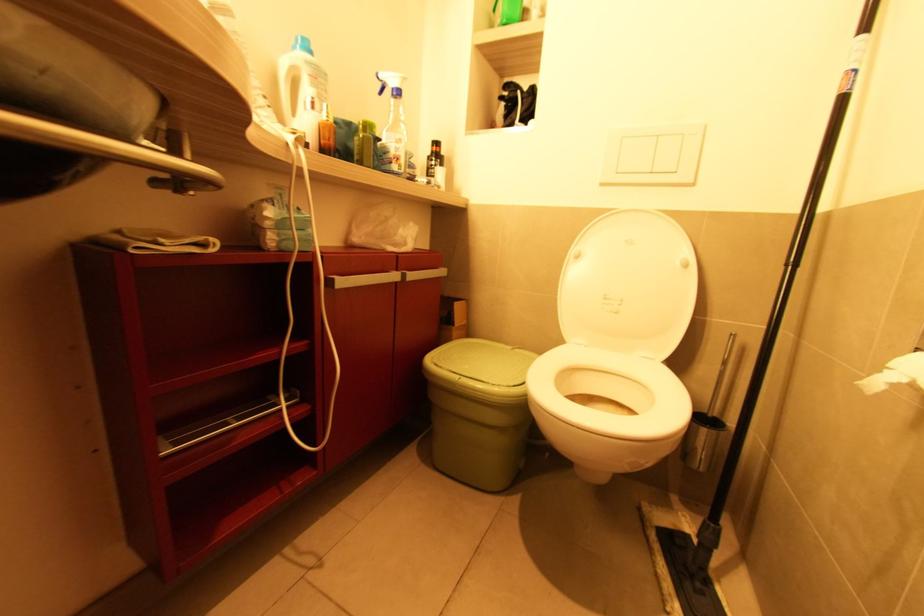
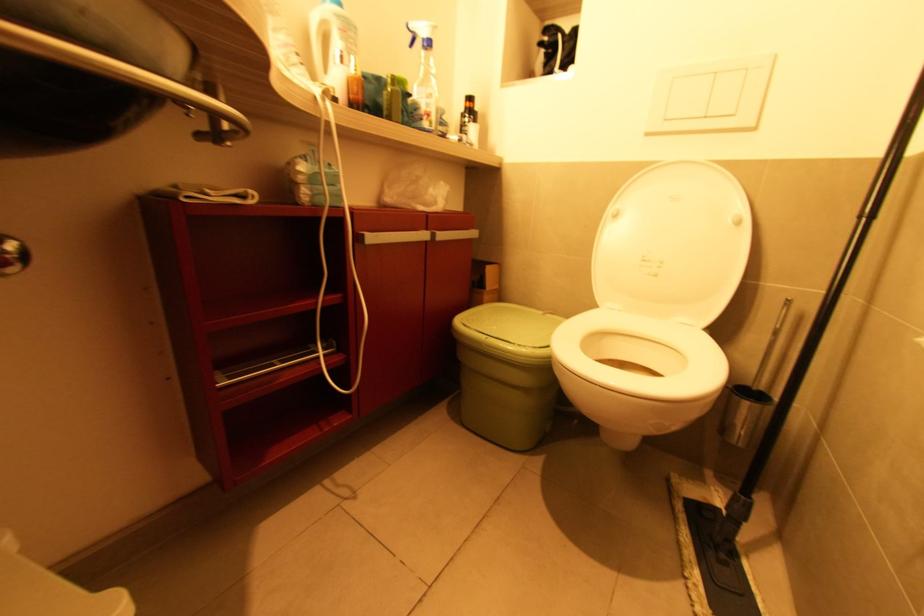
Find the pixel in the second image that matches (396,277) in the first image.

(426, 237)